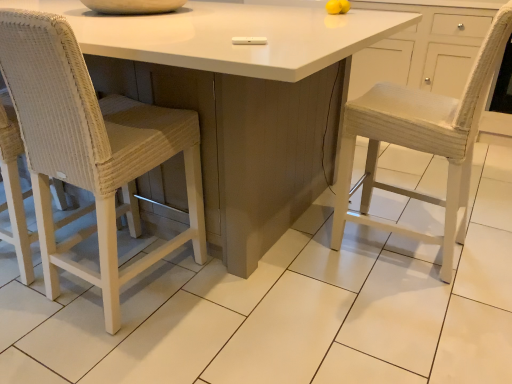
Question: Relative to white glossy table at center, is woven wicker chair at left in front or behind?

Choices:
 (A) front
 (B) behind

Answer: (B)

Question: Is woven wicker chair at left taller or shorter than white glossy table at center?

Choices:
 (A) short
 (B) tall

Answer: (B)

Question: From the image's perspective, relative to white glossy table at center, is woven wicker chair at left above or below?

Choices:
 (A) below
 (B) above

Answer: (A)

Question: From a real-world perspective, is white glossy table at center physically located above or below woven wicker chair at left?

Choices:
 (A) above
 (B) below

Answer: (B)

Question: Considering the positions of white glossy table at center and woven wicker chair at left in the image, is white glossy table at center taller or shorter than woven wicker chair at left?

Choices:
 (A) tall
 (B) short

Answer: (B)

Question: Considering the relative positions of white glossy table at center and woven wicker chair at left in the image provided, is white glossy table at center to the left or to the right of woven wicker chair at left?

Choices:
 (A) left
 (B) right

Answer: (A)

Question: Is white glossy table at center bigger or smaller than woven wicker chair at left?

Choices:
 (A) small
 (B) big

Answer: (B)